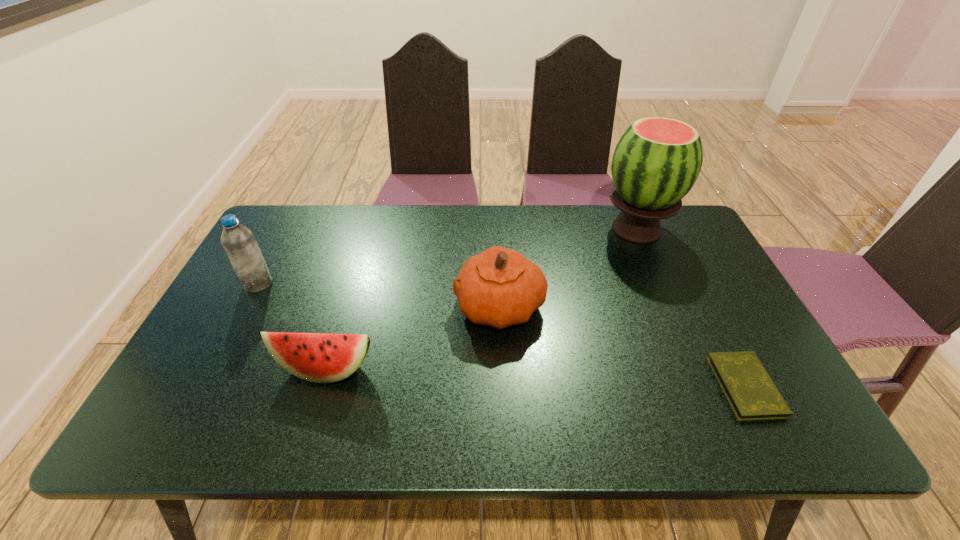
Where is `the closest object to the left watermelon`? The width and height of the screenshot is (960, 540). the closest object to the left watermelon is located at coordinates (499, 287).

Where is `vacant position in the image that satisfies the following two spatial constraints: 1. on the back side of the diary; 2. on the front-facing side of the third shortest object`? vacant position in the image that satisfies the following two spatial constraints: 1. on the back side of the diary; 2. on the front-facing side of the third shortest object is located at coordinates (705, 306).

The height and width of the screenshot is (540, 960). Identify the location of vacant region that satisfies the following two spatial constraints: 1. on the outer rind of the nearer watermelon; 2. on the left side of the diary. (320, 387).

Identify the location of vacant region that satisfies the following two spatial constraints: 1. on the outer rind of the left watermelon; 2. on the right side of the diary. Image resolution: width=960 pixels, height=540 pixels. (320, 387).